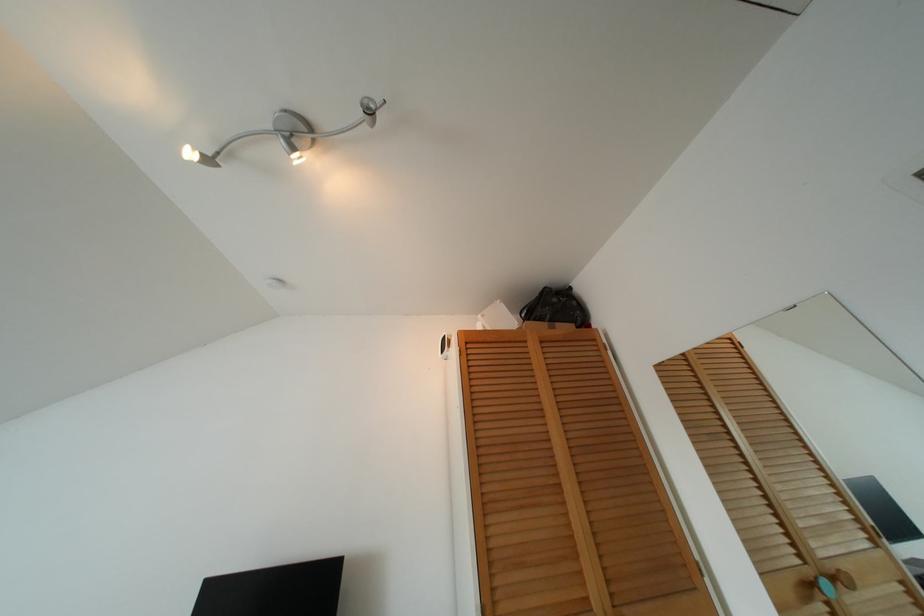
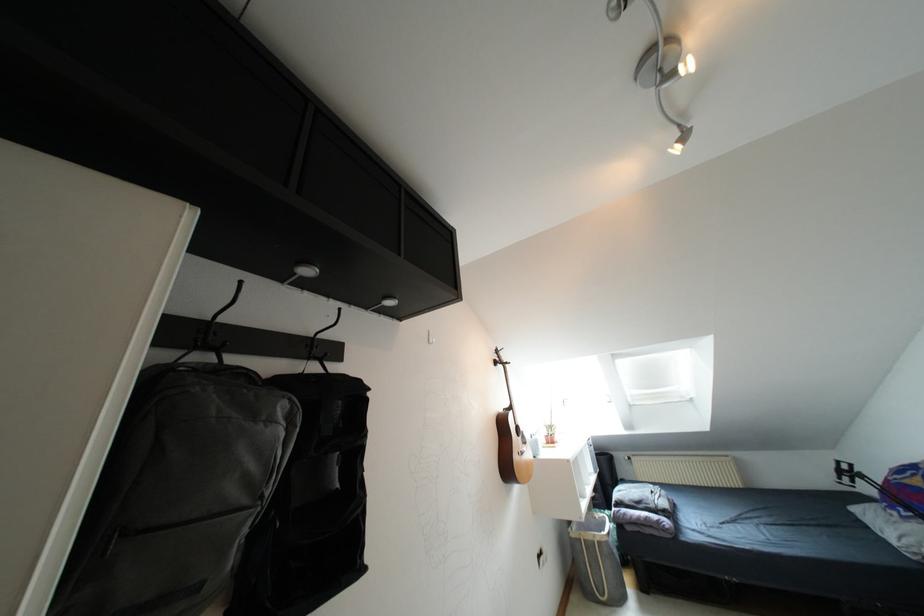
Find the pixel in the second image that matches point 208,160 in the first image.

(683, 138)